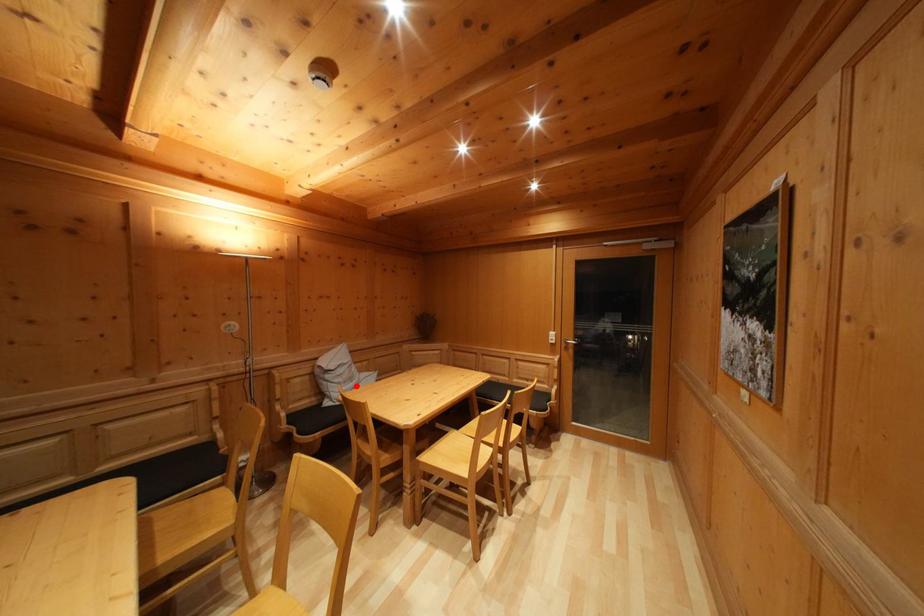
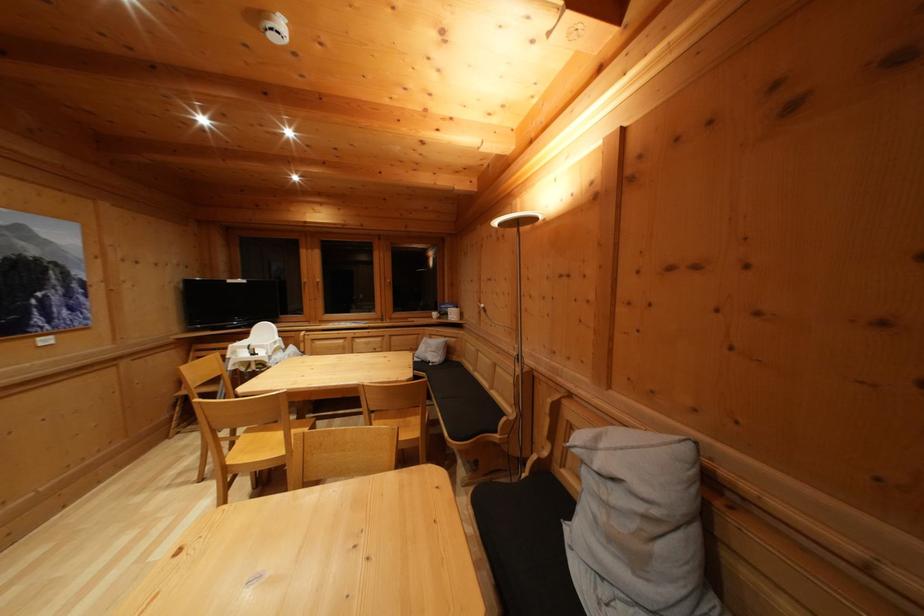
Locate, in the second image, the point that corresponds to the highlighted location in the first image.

(640, 565)